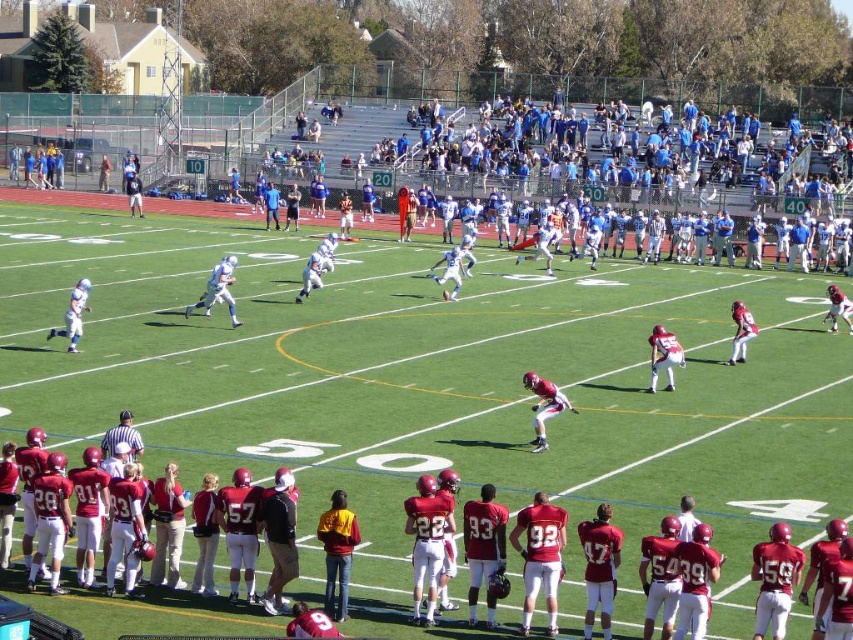
Question: Estimate the real-world distances between objects in this image. Which object is closer to the matte white uniform at left?

Choices:
 (A) shiny red football player at center
 (B) matte white uniform at center
 (C) shiny red helmet at center

Answer: (B)

Question: Which object appears farthest from the camera in this image?

Choices:
 (A) shiny red football player at center
 (B) matte white uniform at left
 (C) shiny red helmet at center

Answer: (B)

Question: Is shiny red helmet at center positioned at the back of matte white uniform at center?

Choices:
 (A) yes
 (B) no

Answer: (B)

Question: Which point is farther to the camera?

Choices:
 (A) (553, 392)
 (B) (67, 336)
 (C) (674, 340)

Answer: (B)

Question: Can you confirm if shiny red helmet at center is thinner than matte white uniform at center?

Choices:
 (A) no
 (B) yes

Answer: (B)

Question: Can you confirm if matte white uniform at center is positioned to the right of matte white uniform at left?

Choices:
 (A) no
 (B) yes

Answer: (B)